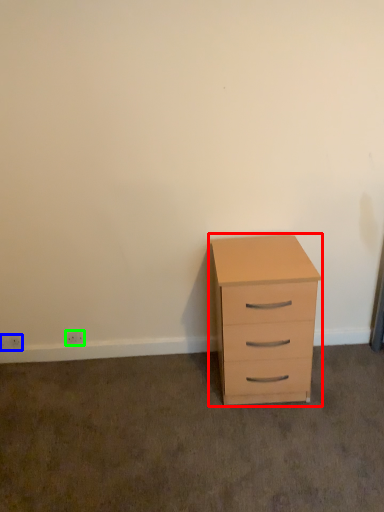
Question: Considering the real-world distances, which object is closest to chest of drawers (highlighted by a red box)? electric outlet (highlighted by a blue box) or electric outlet (highlighted by a green box).

Choices:
 (A) electric outlet
 (B) electric outlet

Answer: (B)